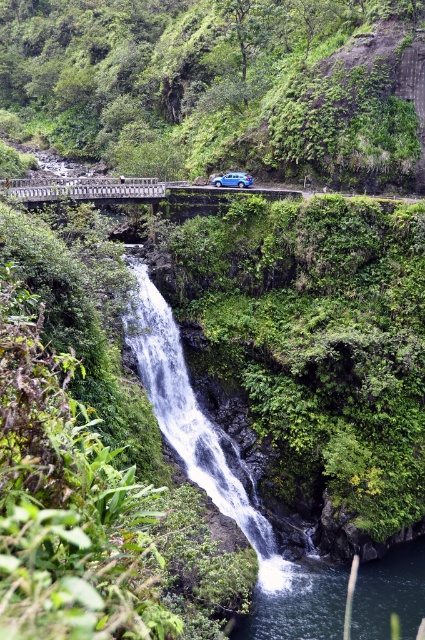
You are a hiker standing on the paved road above the waterfall. You want to take a photo of the clear water at lower center. Which direction should you move to get the green leafy vegetation at center into the frame on the left side of the photo?

You should move to the right on the paved road above the waterfall. Since the green leafy vegetation at center is to the left of clear water at lower center, moving right will position the vegetation on the left side of the photo while keeping the water in view.

You are a hiker planning to cross the white metal bridge at center. The green leafy vegetation at center is blocking part of the bridge. Can you still safely cross the bridge?

The green leafy vegetation at center might be wider than the white metal bridge at center, so it could be blocking the bridge. You should check the actual clearance before attempting to cross to ensure safety.